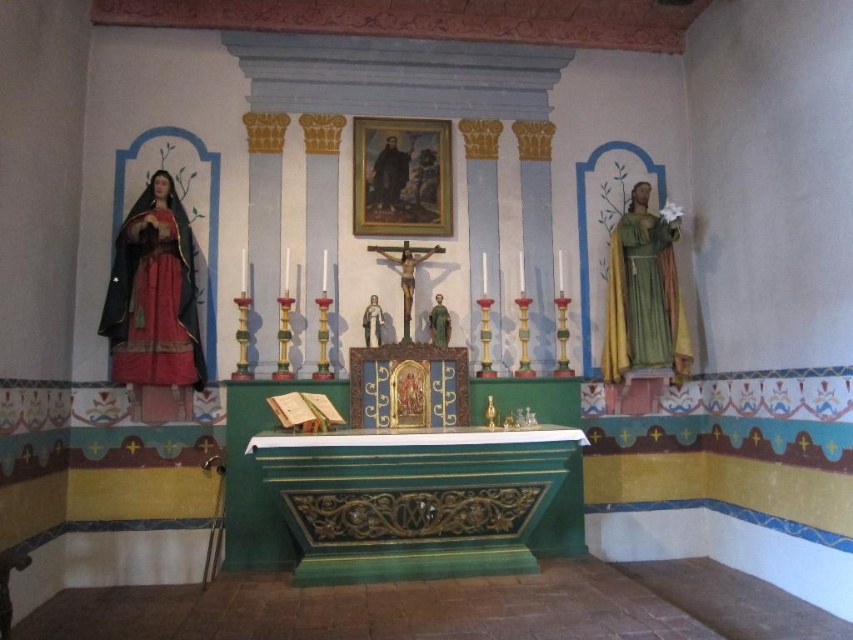
Does green painted wood altar at center come in front of smooth wooden portrait at upper center?

Yes, it is in front of smooth wooden portrait at upper center.

Who is more distant from viewer, (300, 528) or (378, 182)?

Point (378, 182)

This screenshot has width=853, height=640. In order to click on green painted wood altar at center in this screenshot , I will do `click(415, 499)`.

Does point (148, 294) lie behind point (403, 161)?

No, it is in front of (403, 161).

Can you confirm if matte black statue at left is bigger than smooth wooden portrait at upper center?

Correct, matte black statue at left is larger in size than smooth wooden portrait at upper center.

Locate an element on the screen. matte black statue at left is located at coordinates click(154, 307).

Does smooth wooden portrait at upper center have a smaller size compared to wooden crucifix at center?

Indeed, smooth wooden portrait at upper center has a smaller size compared to wooden crucifix at center.

Is point (393, 173) positioned in front of point (432, 246)?

No, it is not.

Does point (384, 145) come behind point (405, 280)?

Yes, point (384, 145) is behind point (405, 280).

Locate an element on the screen. smooth wooden portrait at upper center is located at coordinates (389, 176).